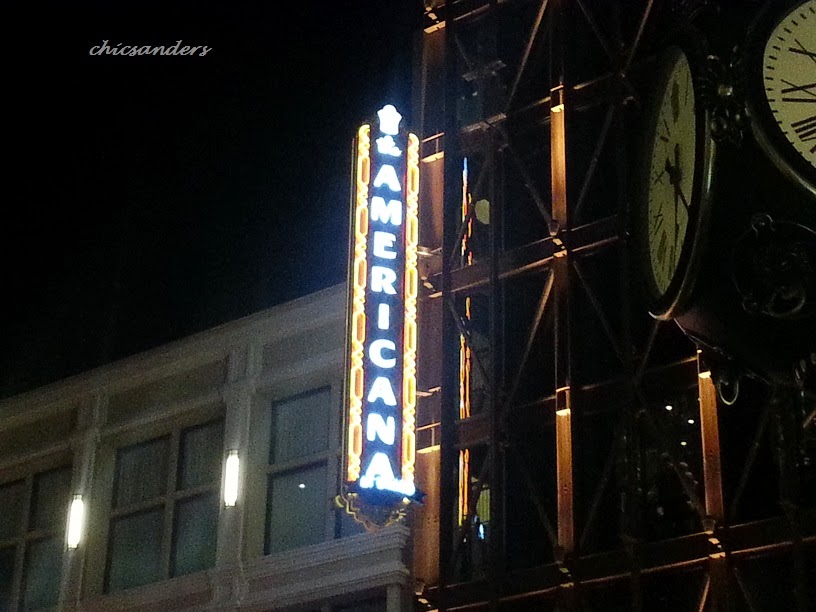
Where is `window`? window is located at coordinates (194, 508).